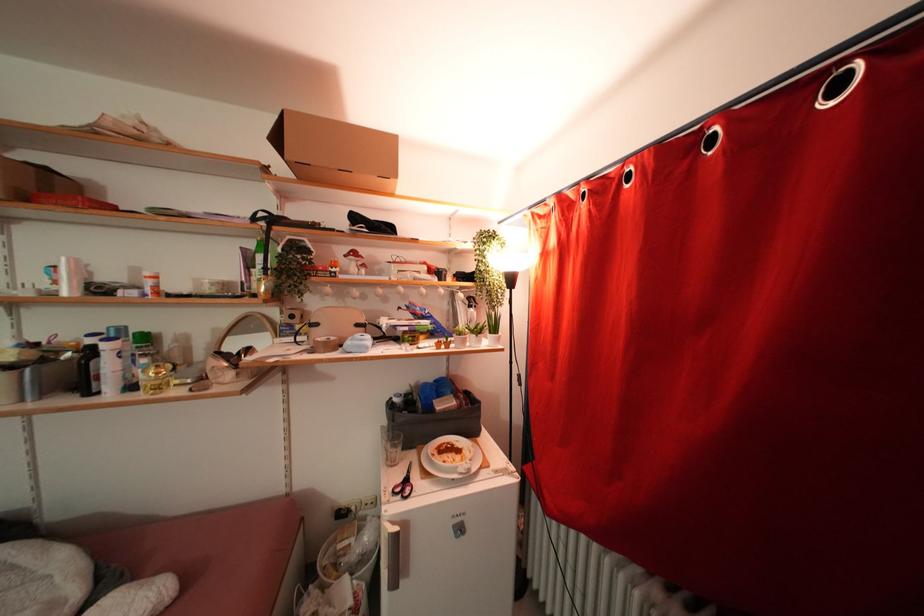
What do you see at coordinates (155, 378) in the screenshot? I see `a gold lidded jar` at bounding box center [155, 378].